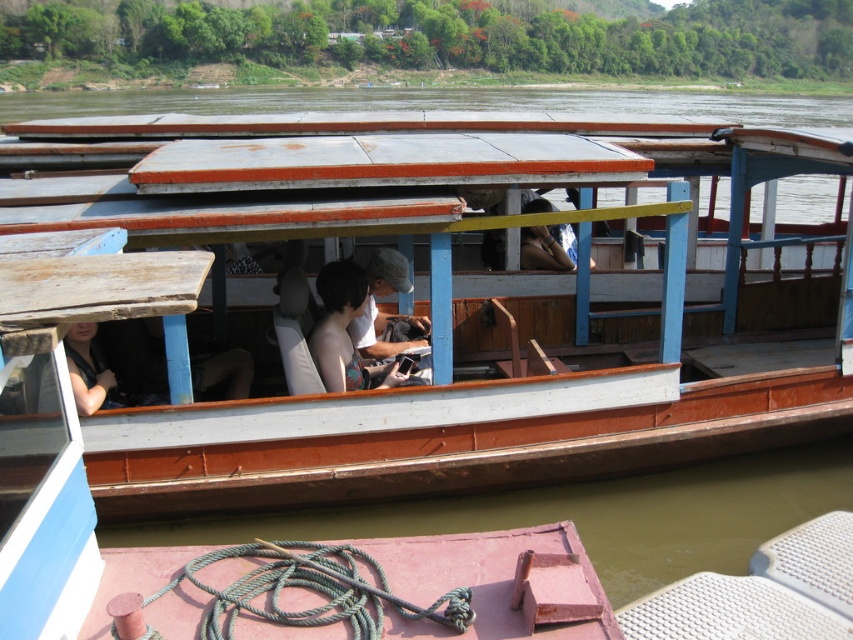
Question: Can you confirm if skinny white shirt at center is positioned to the right of matte gray cap at center?

Choices:
 (A) yes
 (B) no

Answer: (B)

Question: Estimate the real-world distances between objects in this image. Which object is farther from the matte black shirt at center?

Choices:
 (A) wooden boat at center
 (B) matte gray cap at center
 (C) skinny white shirt at center

Answer: (A)

Question: Does wooden boat at center come behind skinny white shirt at center?

Choices:
 (A) yes
 (B) no

Answer: (A)

Question: Which object is the farthest from the skinny white shirt at center?

Choices:
 (A) wooden boat at center
 (B) matte black shirt at center

Answer: (A)

Question: Can you confirm if wooden boat at center is wider than skinny white shirt at center?

Choices:
 (A) yes
 (B) no

Answer: (B)

Question: Which of the following is the closest to the observer?

Choices:
 (A) (363, 282)
 (B) (115, 396)
 (C) (759, 314)
 (D) (396, 282)

Answer: (A)